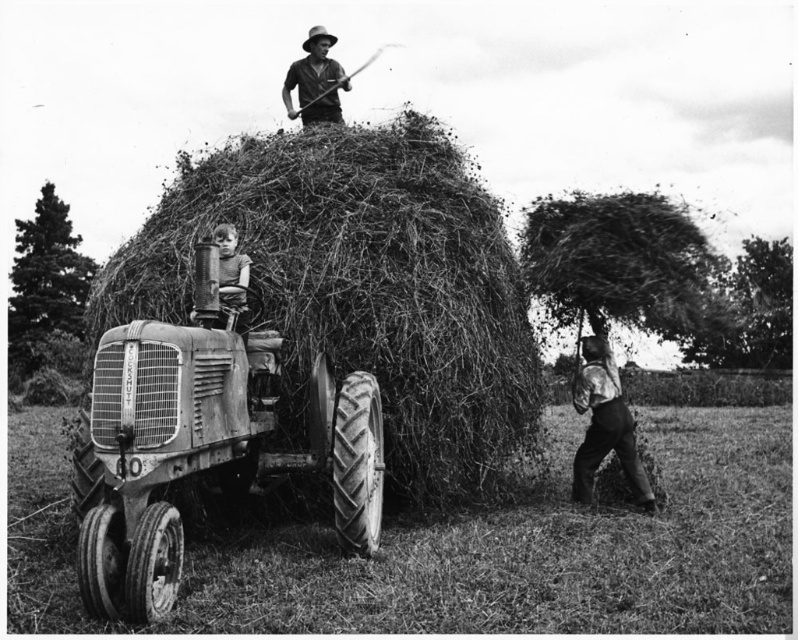
Question: In this image, where is rusty metal tractor at center located relative to smooth leather pants at lower right?

Choices:
 (A) below
 (B) above

Answer: (B)

Question: Is the position of coarse straw bale at center more distant than that of smooth wooden stick at upper center?

Choices:
 (A) yes
 (B) no

Answer: (B)

Question: Which object is farther from the camera taking this photo?

Choices:
 (A) rusty metal tractor at center
 (B) smooth leather pants at lower right
 (C) smooth wooden stick at center

Answer: (B)

Question: Considering the real-world distances, which object is farthest from the smooth wooden stick at upper center?

Choices:
 (A) smooth wooden stick at center
 (B) smooth leather pants at lower right
 (C) coarse straw bale at center
 (D) rusty metal tractor at center

Answer: (D)

Question: Which point is closer to the camera?

Choices:
 (A) (228, 269)
 (B) (315, 97)

Answer: (A)

Question: Does coarse straw bale at center have a lesser width compared to rusty metal tractor at center?

Choices:
 (A) no
 (B) yes

Answer: (A)